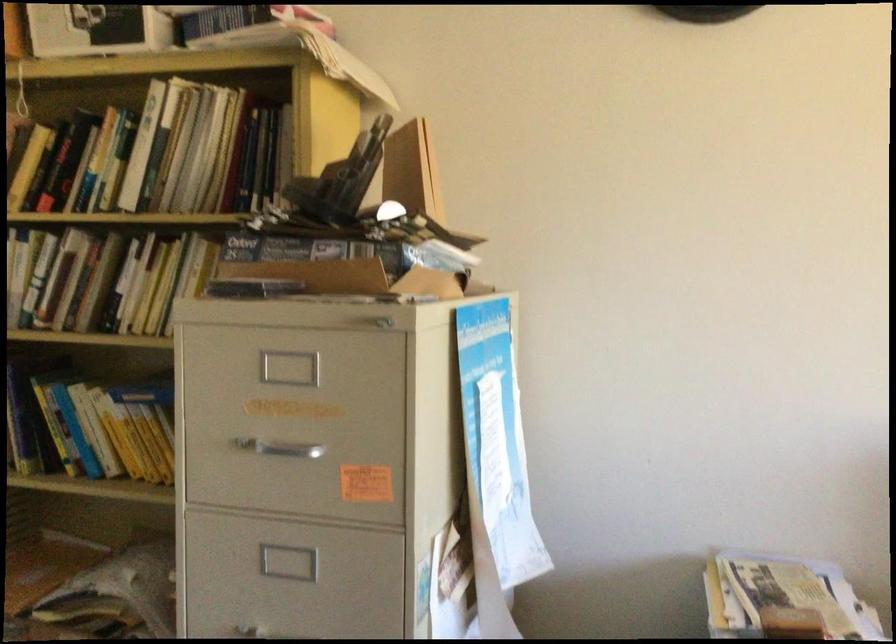
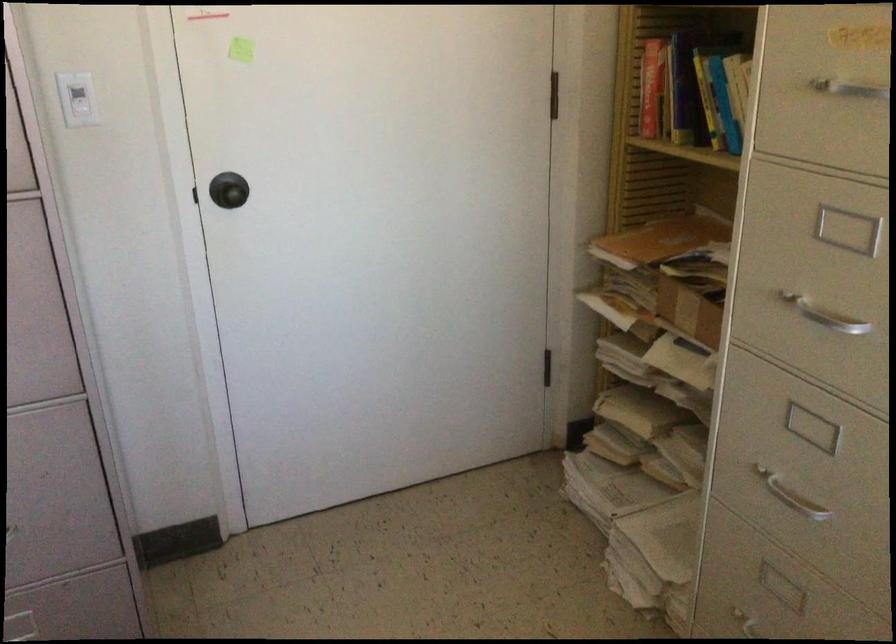
In the second image, find the point that corresponds to (263,438) in the first image.

(839, 82)